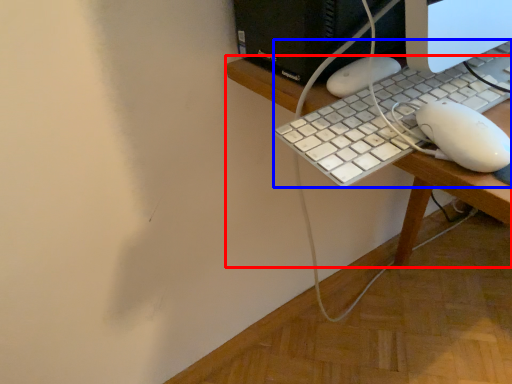
Question: Which of the following is the closest to the observer, desk (highlighted by a red box) or computer keyboard (highlighted by a blue box)?

Choices:
 (A) desk
 (B) computer keyboard

Answer: (A)